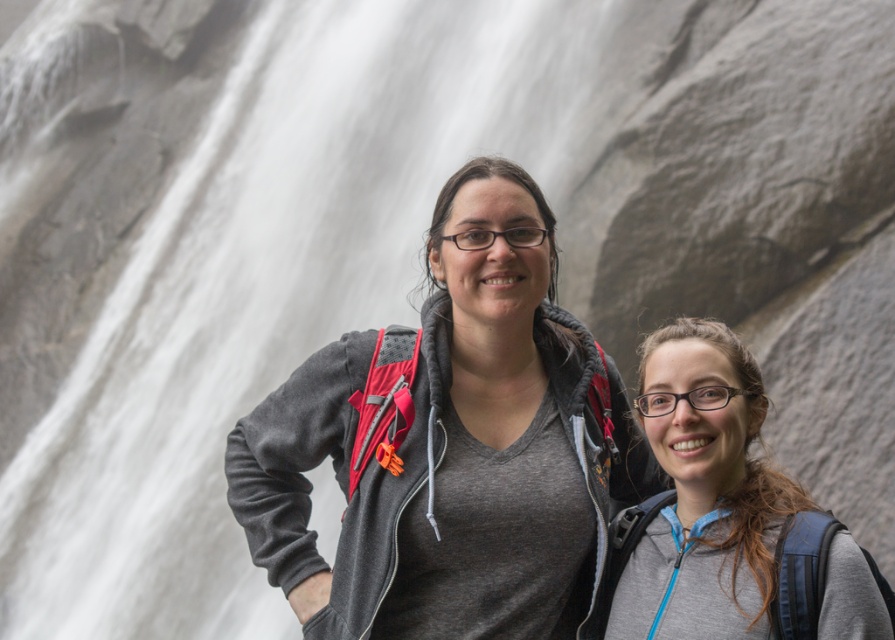
You are standing at the base of the waterfall and want to take a photo of the gray matte jacket at center. Given that your camera has a maximum focus range of 150 feet, will you be able to capture the jacket clearly?

The gray matte jacket at center is 133.82 feet away from the viewer. Since this distance is within the camera maximum focus range of 150 feet, the jacket can be captured clearly.

You are standing at the base of the waterfall and want to reach the point marked as point (358, 602). Given that the average walking speed is 1.4 meters per second, how many seconds will it take to reach that point?

The point (358, 602) is 41.44 meters away from the viewer. At an average walking speed of 1.4 meters per second, it would take approximately 29.6 seconds to reach the point.

You are a photographer trying to capture a photo of the gray matte jacket at center and the gray matte backpack at center. Since both are at the center, how can you determine which one is closer to the camera?

The gray matte jacket at center is located above the gray matte backpack at center, so the jacket is closer to the camera because objects higher in the frame are typically nearer when overlapping.